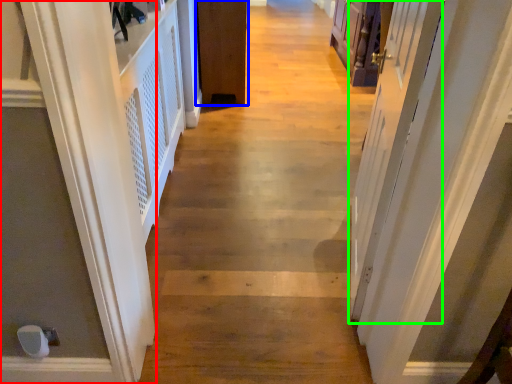
Question: Which object is the farthest from door (highlighted by a red box)? Choose among these: door (highlighted by a blue box) or screen door (highlighted by a green box).

Choices:
 (A) door
 (B) screen door

Answer: (A)